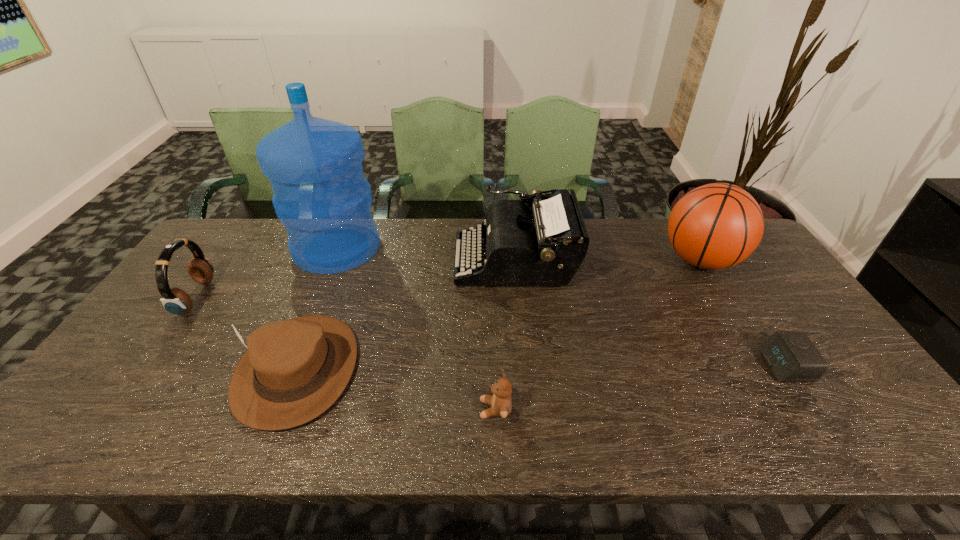
At what (x,y) coordinates should I click in order to perform the action: click on vacant space that's between the fedora and the typewriter. Please return your answer as a coordinate pair (x, y). Looking at the image, I should click on click(x=406, y=314).

Find the location of a particular element. The width and height of the screenshot is (960, 540). free space between the fedora and the teddy bear is located at coordinates (396, 389).

The height and width of the screenshot is (540, 960). Find the location of `object identified as the second closest to the teddy bear`. object identified as the second closest to the teddy bear is located at coordinates (543, 246).

The image size is (960, 540). In order to click on the sixth closest object to the basketball in this screenshot , I will do `click(176, 301)`.